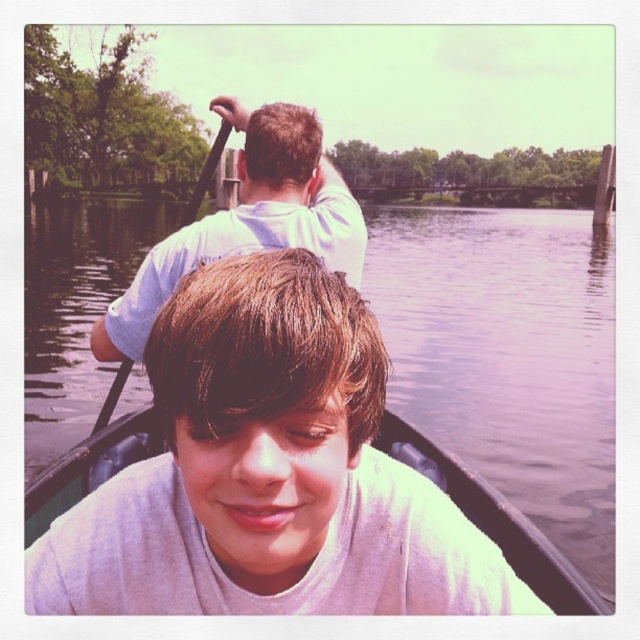
Question: Where is white cotton shirt at upper center located in relation to black wood paddle at upper center in the image?

Choices:
 (A) right
 (B) left

Answer: (A)

Question: Among these points, which one is nearest to the camera?

Choices:
 (A) (218, 403)
 (B) (220, 124)
 (C) (291, 184)

Answer: (A)

Question: Which point is closer to the camera?

Choices:
 (A) (224, 116)
 (B) (291, 488)
 (C) (296, 145)

Answer: (B)

Question: Is smooth white shirt at center further to the viewer compared to black wood paddle at upper center?

Choices:
 (A) yes
 (B) no

Answer: (B)

Question: Which point is farther to the camera?

Choices:
 (A) black wood paddle at upper center
 (B) smooth white shirt at center

Answer: (A)

Question: Is smooth white shirt at center thinner than white cotton shirt at upper center?

Choices:
 (A) no
 (B) yes

Answer: (A)